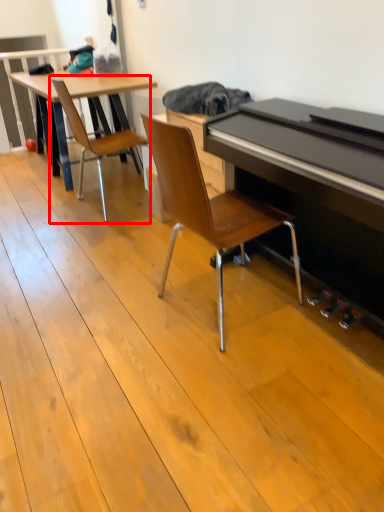
Question: From the image's perspective, considering the relative positions of chair (annotated by the red box) and chair in the image provided, where is chair (annotated by the red box) located with respect to the staircase?

Choices:
 (A) above
 (B) below

Answer: (A)